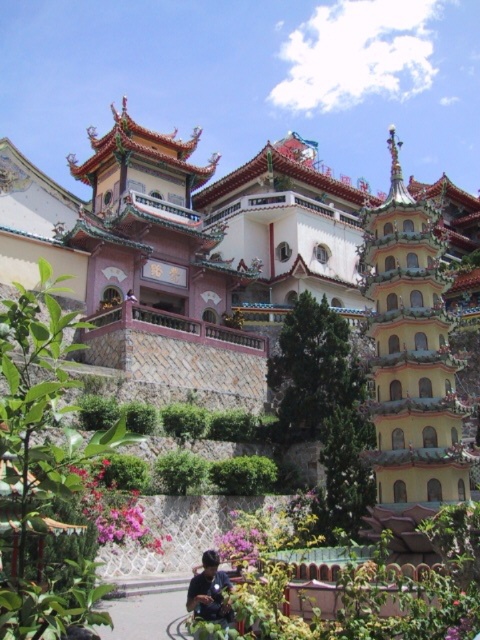
Question: Can you confirm if yellow glazed pagoda at right is positioned above matte black shirt at lower center?

Choices:
 (A) no
 (B) yes

Answer: (B)

Question: Which object is positioned farthest from the white glossy palace at center?

Choices:
 (A) pink matte flowers at lower center
 (B) yellow glazed pagoda at right
 (C) matte black shirt at lower center

Answer: (C)

Question: Which of the following is the farthest from the observer?

Choices:
 (A) matte black shirt at lower center
 (B) white glossy palace at center
 (C) yellow glazed pagoda at right

Answer: (B)

Question: Can you confirm if white glossy palace at center is bigger than yellow glazed pagoda at right?

Choices:
 (A) yes
 (B) no

Answer: (A)

Question: Is white glossy palace at center thinner than pink matte flowers at lower center?

Choices:
 (A) yes
 (B) no

Answer: (B)

Question: Which point appears closest to the camera in this image?

Choices:
 (A) (228, 625)
 (B) (135, 538)

Answer: (A)